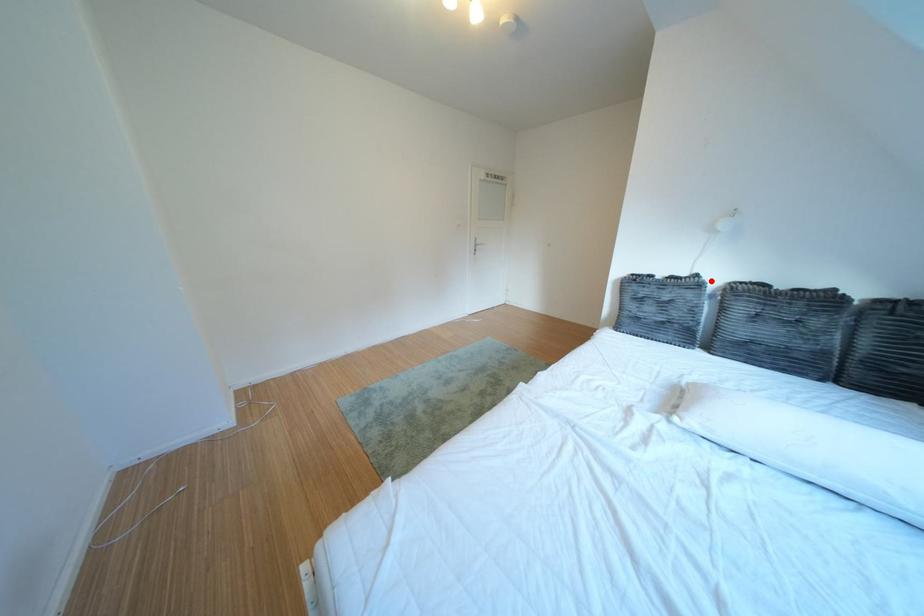
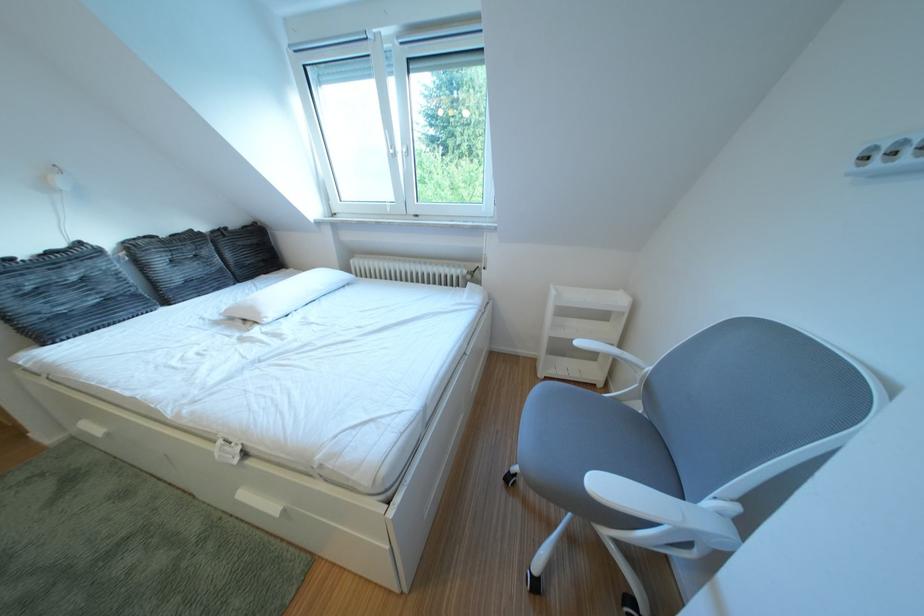
Find the pixel in the second image that matches the highlighted location in the first image.

(93, 249)